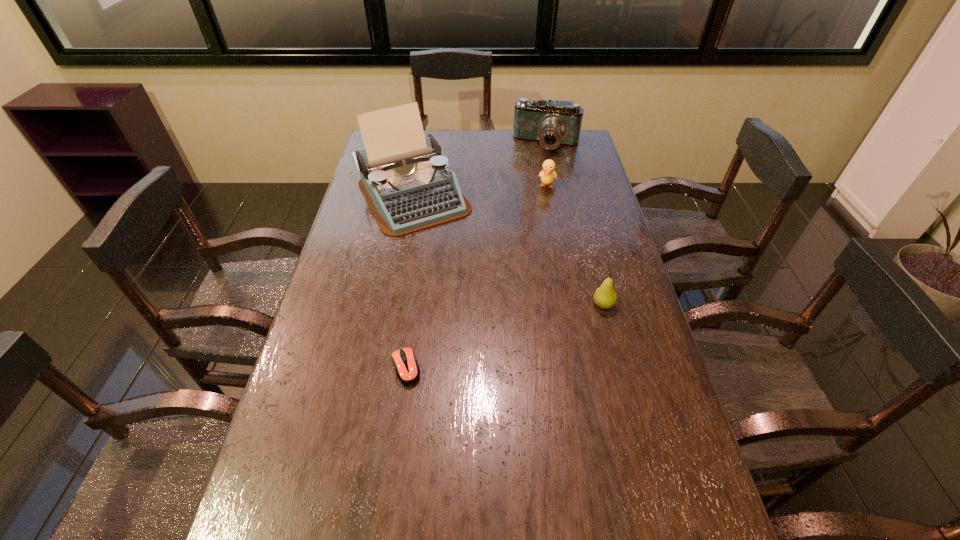
What are the coordinates of `the shortest object` in the screenshot? It's located at (407, 369).

Find the location of `the nearest object`. the nearest object is located at coordinates (407, 369).

Locate an element on the screen. the fourth farthest object is located at coordinates (605, 297).

At what (x,y) coordinates should I click in order to perform the action: click on duckling. Please return your answer as a coordinate pair (x, y). Looking at the image, I should click on (548, 174).

This screenshot has width=960, height=540. Find the location of `the second tallest object`. the second tallest object is located at coordinates (551, 123).

What are the coordinates of `camcorder` in the screenshot? It's located at (551, 123).

Image resolution: width=960 pixels, height=540 pixels. Find the location of `typewriter`. typewriter is located at coordinates (409, 187).

The image size is (960, 540). I want to click on vacant space located 0.200m on the right of the nearest object, so click(x=502, y=368).

Identify the location of vacant region located 0.190m on the front of the fourth farthest object. The height and width of the screenshot is (540, 960). (620, 374).

Where is `free region located 0.150m on the front-facing side of the duckling`? This screenshot has height=540, width=960. free region located 0.150m on the front-facing side of the duckling is located at coordinates (542, 218).